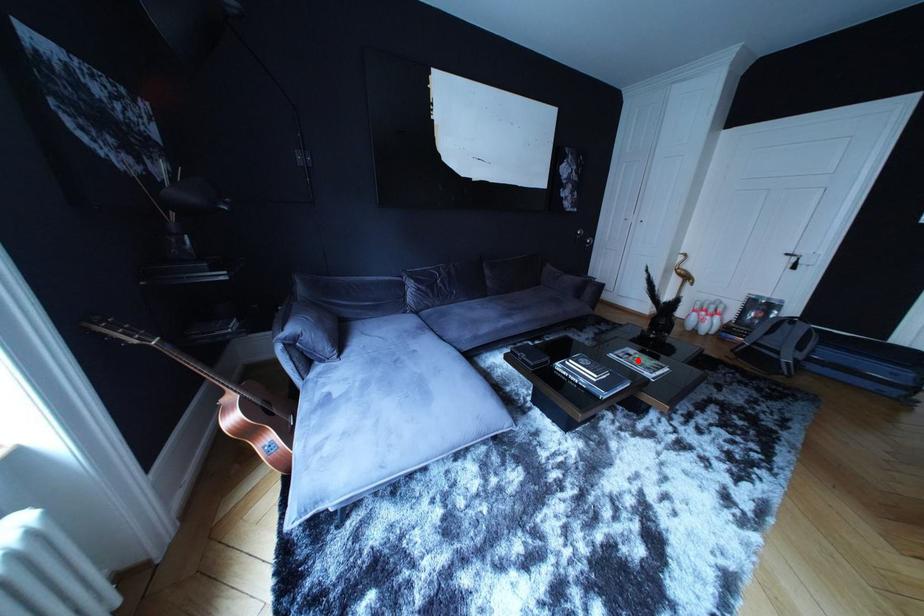
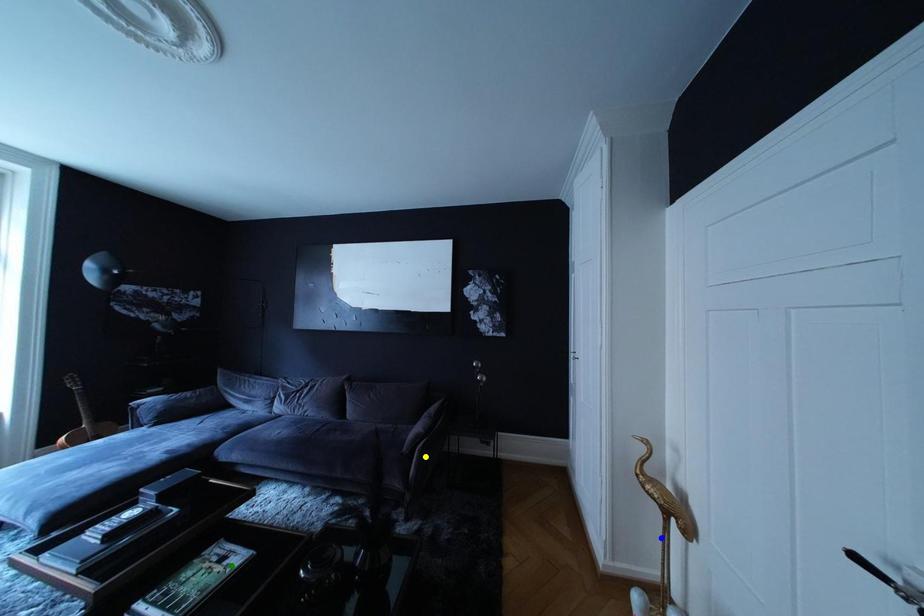
Question: I am providing you with two images of the same scene from different viewpoints. A red point is marked on the first image. You are given multiple points on the second image. Which mark in image 2 goes with the point in image 1?

Choices:
 (A) yellow point
 (B) blue point
 (C) green point

Answer: (C)